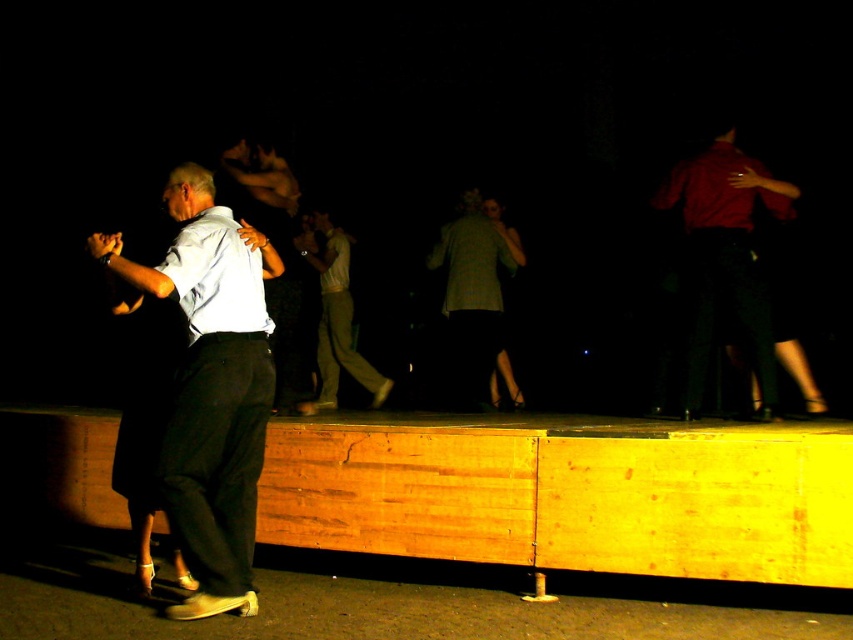
Question: Is the position of light blue shirt at center less distant than that of matte red shirt at upper right?

Choices:
 (A) yes
 (B) no

Answer: (A)

Question: Does matte red shirt at upper right come in front of light green cotton pants at center?

Choices:
 (A) no
 (B) yes

Answer: (B)

Question: Which of the following is the closest to the observer?

Choices:
 (A) light green cotton pants at center
 (B) green plaid shirt at center

Answer: (A)

Question: Is the position of matte red shirt at upper right less distant than that of light green cotton pants at center?

Choices:
 (A) yes
 (B) no

Answer: (A)

Question: Which object is the farthest from the green plaid shirt at center?

Choices:
 (A) matte red shirt at upper right
 (B) light green cotton pants at center

Answer: (A)

Question: Which point appears closest to the camera in this image?

Choices:
 (A) (323, 246)
 (B) (213, 298)
 (C) (469, 360)

Answer: (B)